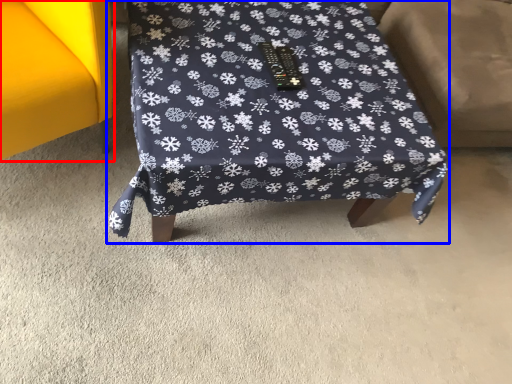
Question: Among these objects, which one is nearest to the camera, furniture (highlighted by a red box) or furniture (highlighted by a blue box)?

Choices:
 (A) furniture
 (B) furniture

Answer: (A)